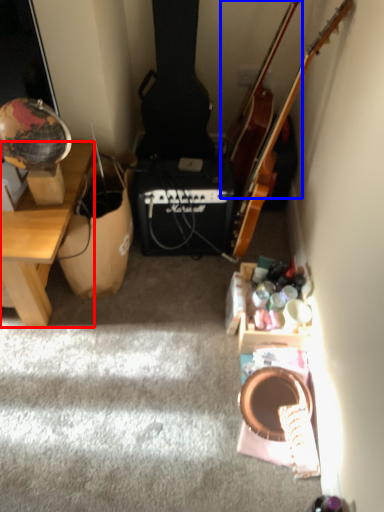
Question: Which object is further to the camera taking this photo, desk (highlighted by a red box) or cello (highlighted by a blue box)?

Choices:
 (A) desk
 (B) cello

Answer: (B)